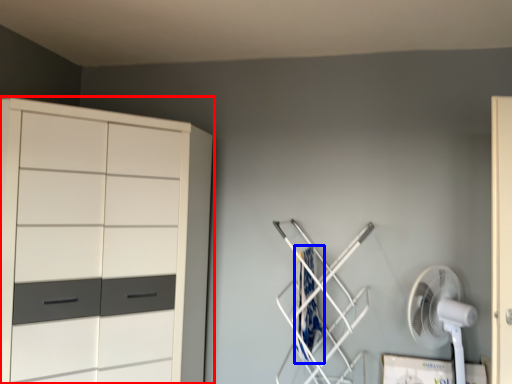
Question: Which point is further to the camera, cupboard (highlighted by a red box) or laundry (highlighted by a blue box)?

Choices:
 (A) cupboard
 (B) laundry

Answer: (B)